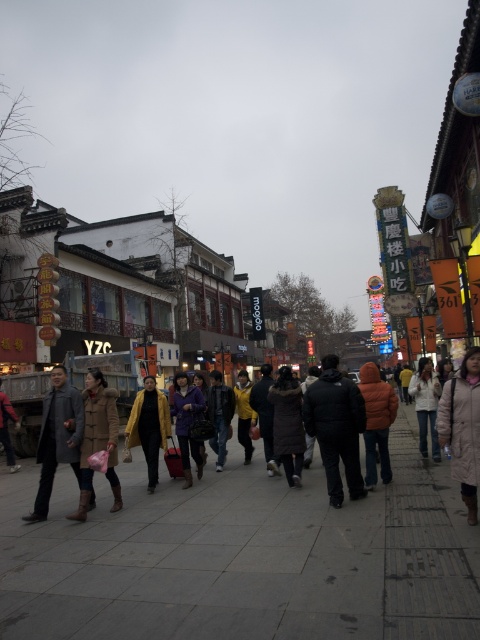
You are a photographer standing on the sidewalk. You want to take a photo of the white fur coat at right and the orange puffy jacket at center. Which of the two items is smaller in size?

The white fur coat at right has a smaller size compared to the orange puffy jacket at center, so the white fur coat at right is smaller in size.

Please provide the 2D coordinates of the black matte jacket at center in the image. The coordinates should be in the format of a point with two decimal places separated by a comma. The scene is a bustling street with an overcast sky and pedestrians in winter clothing.

The 2D coordinates of the black matte jacket at center are at point (336,428).